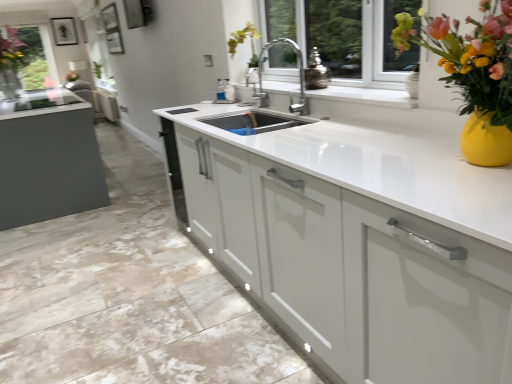
Question: Is white glossy cabinet at center, arranged as the 2th cabinetry when viewed from the front, thinner than vibrant ceramic vase at upper right?

Choices:
 (A) no
 (B) yes

Answer: (B)

Question: From a real-world perspective, is white glossy cabinet at center, which is the 1th cabinetry in top-to-bottom order, physically above vibrant ceramic vase at upper right?

Choices:
 (A) no
 (B) yes

Answer: (A)

Question: Is white glossy cabinet at center, arranged as the 2th cabinetry when viewed from the front, bigger than vibrant ceramic vase at upper right?

Choices:
 (A) no
 (B) yes

Answer: (B)

Question: Is the position of white glossy cabinet at center, arranged as the 2th cabinetry when viewed from the front, more distant than that of vibrant ceramic vase at upper right?

Choices:
 (A) no
 (B) yes

Answer: (B)

Question: Is white glossy cabinet at center, arranged as the 2th cabinetry when viewed from the front, outside of vibrant ceramic vase at upper right?

Choices:
 (A) no
 (B) yes

Answer: (B)

Question: Is white glossy cabinet at center, arranged as the 2th cabinetry when viewed from the front, in contact with vibrant ceramic vase at upper right?

Choices:
 (A) yes
 (B) no

Answer: (B)

Question: Is white glossy cabinet at center, the 2th cabinetry from the back, at the left side of white glossy cabinet at center, which is the 1th cabinetry in top-to-bottom order?

Choices:
 (A) yes
 (B) no

Answer: (B)

Question: From a real-world perspective, does white glossy cabinet at center, the 2th cabinetry from the back, sit lower than white glossy cabinet at center, which is the 1th cabinetry in top-to-bottom order?

Choices:
 (A) no
 (B) yes

Answer: (B)

Question: Is white glossy cabinet at center, marked as the first cabinetry in a front-to-back arrangement, oriented away from white glossy cabinet at center, which is the second cabinetry from bottom to top?

Choices:
 (A) yes
 (B) no

Answer: (B)

Question: Is white glossy cabinet at center, the 2th cabinetry from the back, positioned beyond the bounds of white glossy cabinet at center, arranged as the 2th cabinetry when viewed from the front?

Choices:
 (A) yes
 (B) no

Answer: (A)

Question: Is white glossy cabinet at center, the second cabinetry viewed from the top, positioned in front of white glossy cabinet at center, arranged as the 2th cabinetry when viewed from the front?

Choices:
 (A) no
 (B) yes

Answer: (B)

Question: From the image's perspective, is white glossy cabinet at center, the 2th cabinetry from the back, on white glossy cabinet at center, which is the 1th cabinetry in top-to-bottom order?

Choices:
 (A) no
 (B) yes

Answer: (A)

Question: Is transparent glass window at upper left far from white glossy cabinet at center, positioned as the first cabinetry in bottom-to-top order?

Choices:
 (A) yes
 (B) no

Answer: (A)